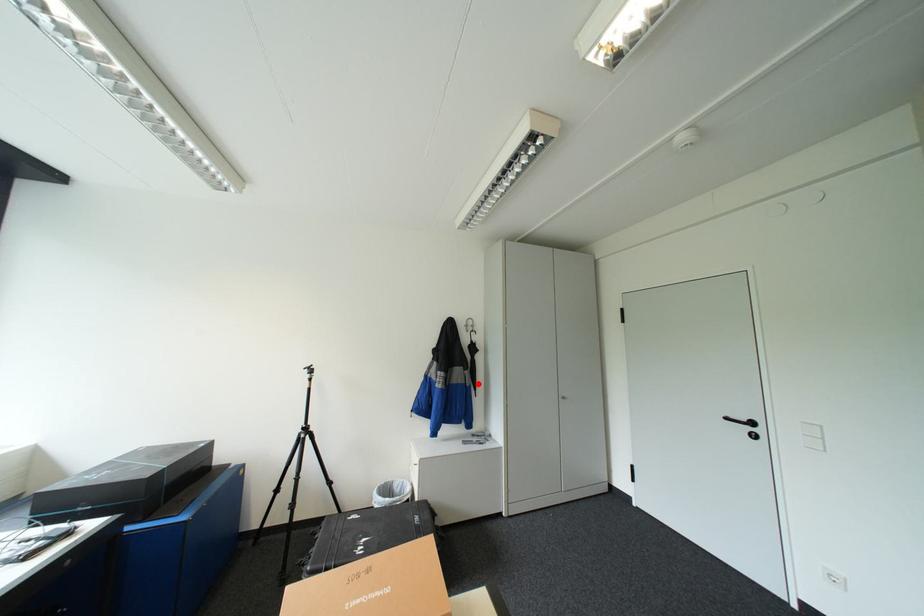
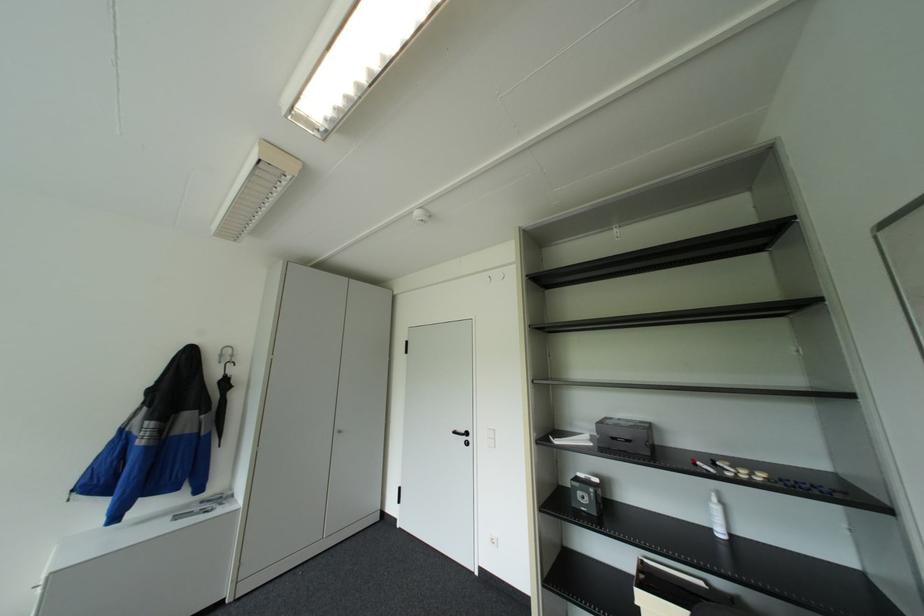
Locate, in the second image, the point that corresponds to the highlighted location in the first image.

(217, 432)